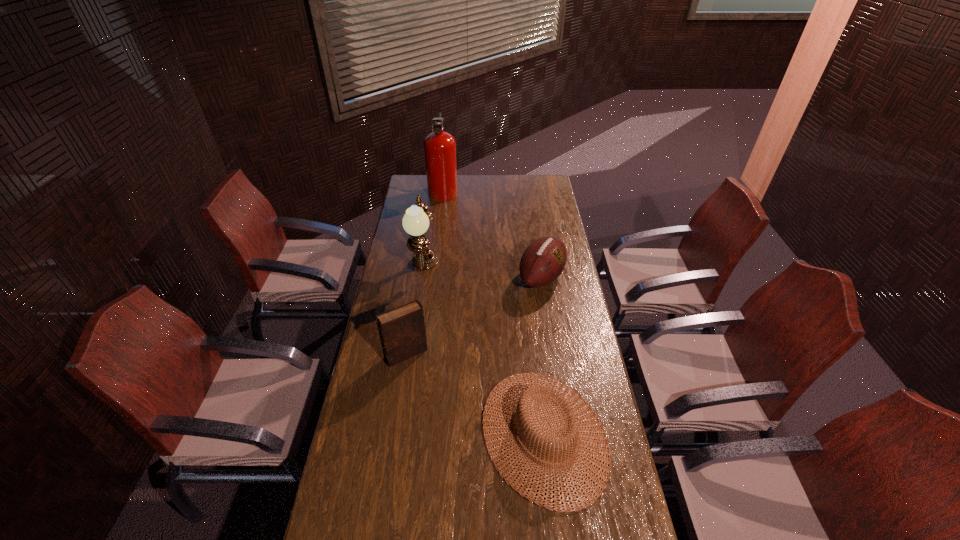
The width and height of the screenshot is (960, 540). I want to click on vacant space at the left edge, so click(x=341, y=519).

The width and height of the screenshot is (960, 540). Identify the location of free location at the right edge of the desktop. (557, 207).

Locate an element on the screen. The width and height of the screenshot is (960, 540). vacant space at the far right corner of the desktop is located at coordinates 535,176.

This screenshot has height=540, width=960. Identify the location of unoccupied area between the fire extinguisher and the fourth tallest object. (492, 234).

Find the location of a particular element. free space between the tallest object and the nearest object is located at coordinates (493, 313).

You are a GUI agent. You are given a task and a screenshot of the screen. Output one action in this format:
    pyautogui.click(x=<x>, y=<y>)
    Task: Click on the unoccupied position between the tallest object and the third shortest object
    The image size is (960, 540).
    Given the screenshot: What is the action you would take?
    pyautogui.click(x=425, y=272)

Locate an element on the screen. The height and width of the screenshot is (540, 960). unoccupied area between the fourth shortest object and the nearest object is located at coordinates (484, 352).

You are a GUI agent. You are given a task and a screenshot of the screen. Output one action in this format:
    pyautogui.click(x=<x>, y=<y>)
    Task: Click on the free point between the third tallest object and the nearest object
    The height and width of the screenshot is (540, 960).
    Given the screenshot: What is the action you would take?
    pyautogui.click(x=475, y=394)

This screenshot has height=540, width=960. I want to click on free space between the nearest object and the football (American), so click(542, 356).

This screenshot has width=960, height=540. What are the coordinates of `free space between the fourth farthest object and the farthest object` in the screenshot? It's located at (425, 272).